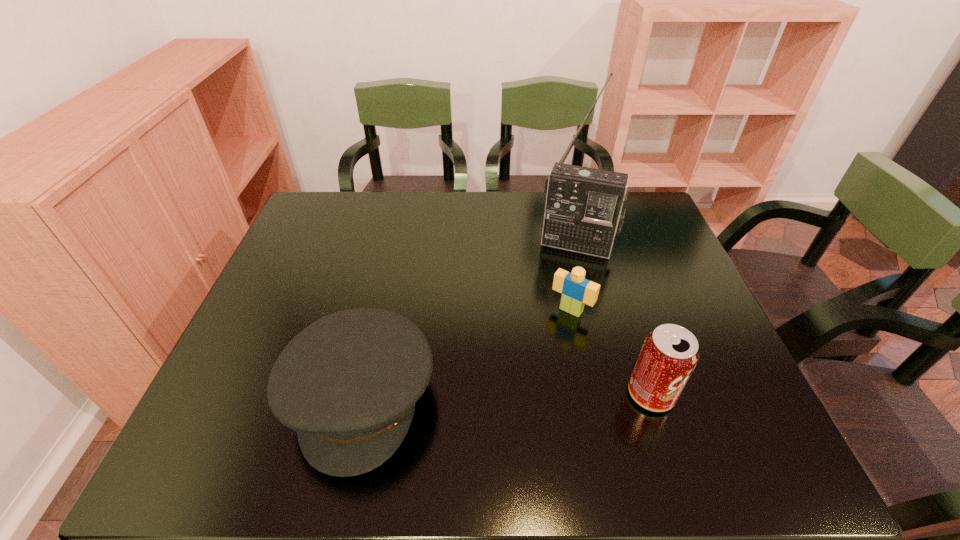
Identify the location of vacant point located between the leftmost object and the farthest object. (469, 321).

Locate an element on the screen. This screenshot has height=540, width=960. free space between the second farthest object and the third shortest object is located at coordinates (612, 352).

The image size is (960, 540). What are the coordinates of `empty space between the third nearest object and the soda can` in the screenshot? It's located at (612, 352).

Where is `object that ranks as the third closest to the beret`? Image resolution: width=960 pixels, height=540 pixels. object that ranks as the third closest to the beret is located at coordinates (x=669, y=354).

Point out which object is positioned as the nearest to the farthest object. Please provide its 2D coordinates. Your answer should be formatted as a tuple, i.e. [(x, y)], where the tuple contains the x and y coordinates of a point satisfying the conditions above.

[(577, 291)]

What are the coordinates of `vacant region that satisfies the following two spatial constraints: 1. on the front side of the soda can; 2. on the right side of the third nearest object` in the screenshot? It's located at (588, 394).

Identify the location of free spot that satisfies the following two spatial constraints: 1. on the front side of the Lego; 2. on the left side of the third shortest object. (588, 394).

The height and width of the screenshot is (540, 960). Identify the location of vacant point that satisfies the following two spatial constraints: 1. on the back side of the farthest object; 2. on the left side of the Lego. (558, 245).

In order to click on blank space that satisfies the following two spatial constraints: 1. on the front side of the soda can; 2. on the right side of the tallest object in this screenshot , I will do `click(616, 394)`.

The height and width of the screenshot is (540, 960). In order to click on free spot that satisfies the following two spatial constraints: 1. on the front side of the third nearest object; 2. on the left side of the third shortest object in this screenshot , I will do `click(588, 394)`.